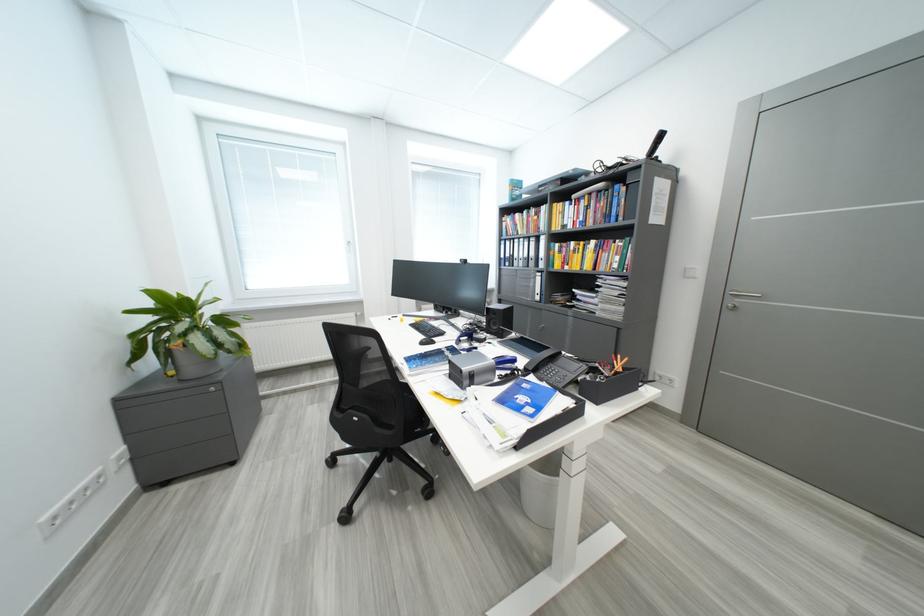
The width and height of the screenshot is (924, 616). Find the location of `black telephone handset`. black telephone handset is located at coordinates (540, 360).